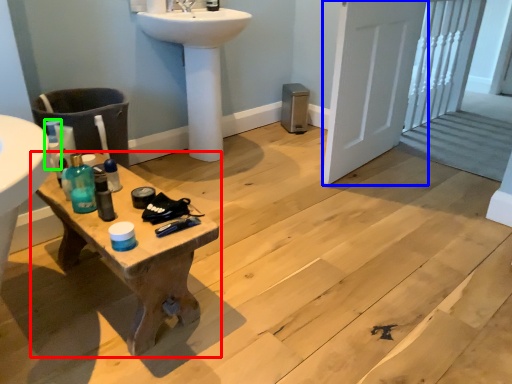
Question: Which object is the farthest from table (highlighted by a red box)? Choose among these: screen door (highlighted by a blue box) or bottle (highlighted by a green box).

Choices:
 (A) screen door
 (B) bottle

Answer: (A)